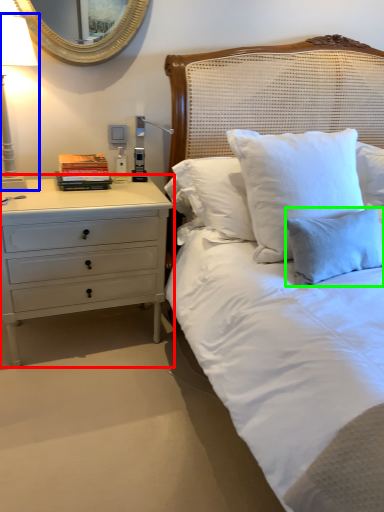
Question: Which object is positioned closest to chest of drawers (highlighted by a red box)? Select from bedside lamp (highlighted by a blue box) and pillow (highlighted by a green box).

Choices:
 (A) bedside lamp
 (B) pillow

Answer: (A)